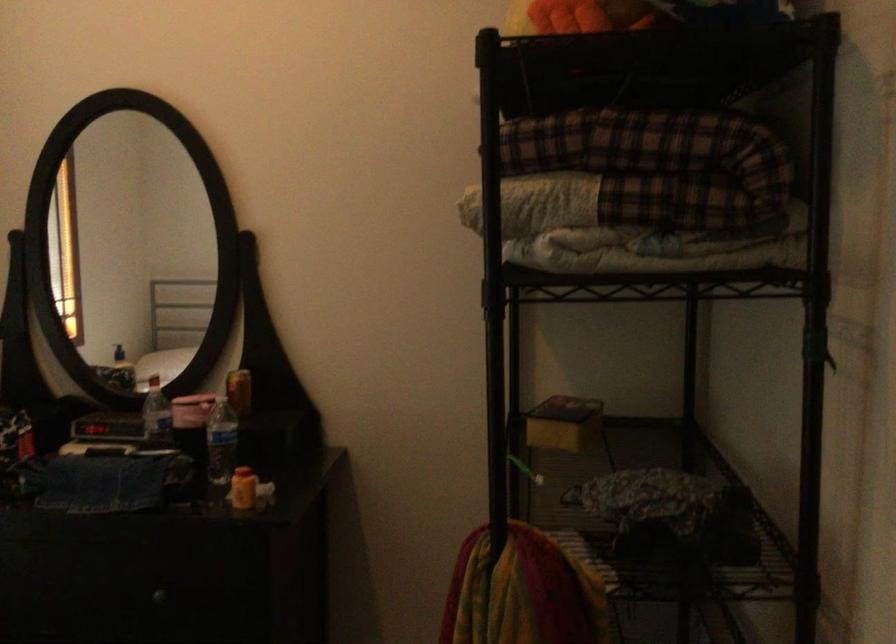
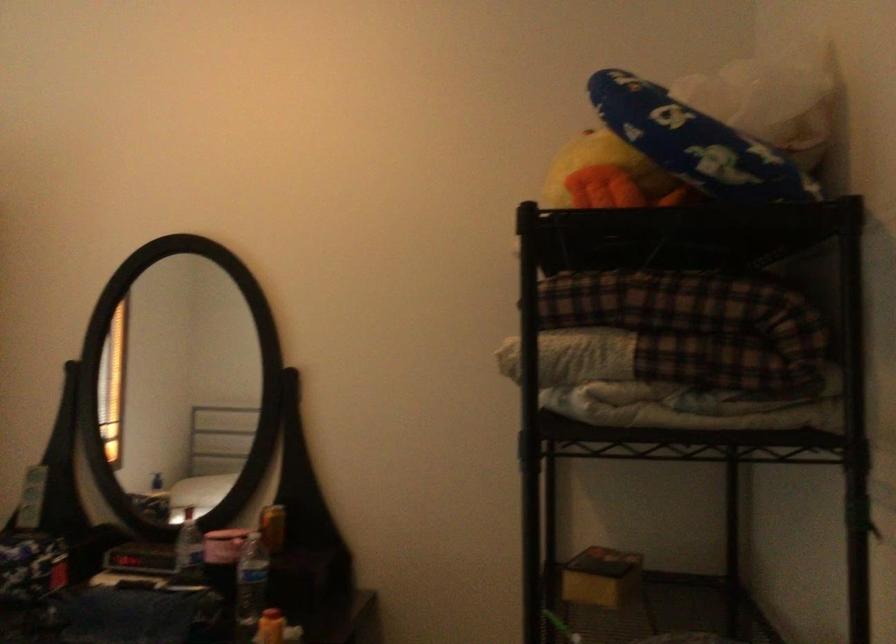
The point at (220, 444) is marked in the first image. Where is the corresponding point in the second image?

(250, 585)